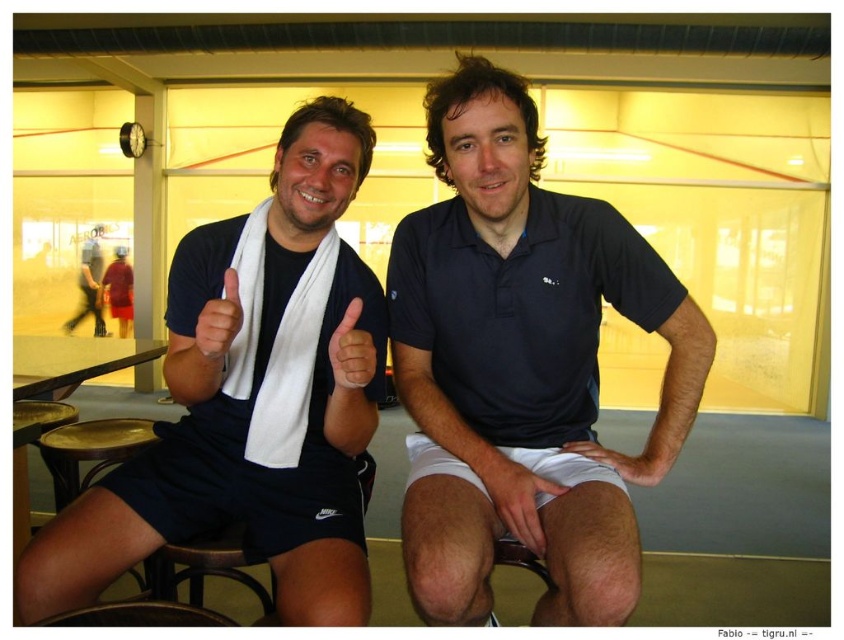
Question: Which object is farther from the camera taking this photo?

Choices:
 (A) white fabric hand at center
 (B) black matte polo shirt at left
 (C) dark blue cotton polo shirt at center

Answer: (C)

Question: Which of the following is the farthest from the observer?

Choices:
 (A) (525, 516)
 (B) (90, 244)

Answer: (B)

Question: Can you confirm if black matte polo shirt at left is wider than white matte hand at center?

Choices:
 (A) no
 (B) yes

Answer: (B)

Question: Can you confirm if matte white towel at upper center is positioned below dark blue shorts at center?

Choices:
 (A) yes
 (B) no

Answer: (A)

Question: Which point appears farthest from the camera in this image?

Choices:
 (A) (475, 298)
 (B) (529, 493)
 (C) (484, 291)
 (D) (276, 314)

Answer: (D)

Question: Considering the relative positions of black matte polo shirt at left and white matte hand at center in the image provided, where is black matte polo shirt at left located with respect to white matte hand at center?

Choices:
 (A) above
 (B) below

Answer: (A)